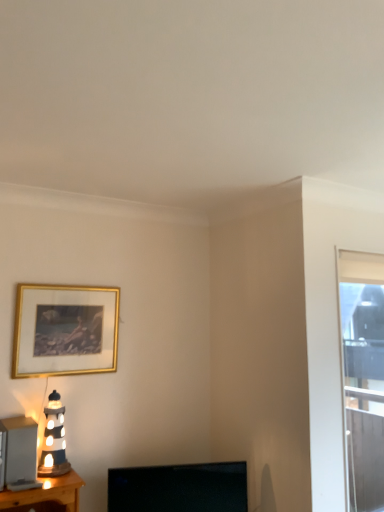
Question: Considering the relative sizes of gold metallic picture frame at upper left and matte ceramic lighthouse at left in the image provided, is gold metallic picture frame at upper left wider than matte ceramic lighthouse at left?

Choices:
 (A) yes
 (B) no

Answer: (B)

Question: Is matte ceramic lighthouse at left inside gold metallic picture frame at upper left?

Choices:
 (A) no
 (B) yes

Answer: (A)

Question: Can you confirm if gold metallic picture frame at upper left is bigger than matte ceramic lighthouse at left?

Choices:
 (A) yes
 (B) no

Answer: (A)

Question: Is gold metallic picture frame at upper left at the right side of matte ceramic lighthouse at left?

Choices:
 (A) no
 (B) yes

Answer: (B)

Question: Is gold metallic picture frame at upper left taller than matte ceramic lighthouse at left?

Choices:
 (A) yes
 (B) no

Answer: (A)

Question: Looking at their shapes, would you say gold metallic picture frame at upper left is wider or thinner than black glossy tv at lower center?

Choices:
 (A) thin
 (B) wide

Answer: (A)

Question: Is point (104, 296) closer or farther from the camera than point (135, 478)?

Choices:
 (A) closer
 (B) farther

Answer: (B)

Question: Is gold metallic picture frame at upper left taller or shorter than black glossy tv at lower center?

Choices:
 (A) short
 (B) tall

Answer: (B)

Question: From a real-world perspective, is gold metallic picture frame at upper left physically located above or below black glossy tv at lower center?

Choices:
 (A) below
 (B) above

Answer: (B)

Question: Does point (51, 465) appear closer or farther from the camera than point (165, 504)?

Choices:
 (A) closer
 (B) farther

Answer: (A)

Question: Is matte ceramic lighthouse at left wider or thinner than black glossy tv at lower center?

Choices:
 (A) thin
 (B) wide

Answer: (B)

Question: In the image, is matte ceramic lighthouse at left on the left side or the right side of black glossy tv at lower center?

Choices:
 (A) right
 (B) left

Answer: (B)

Question: Do you think matte ceramic lighthouse at left is within black glossy tv at lower center, or outside of it?

Choices:
 (A) inside
 (B) outside

Answer: (B)

Question: In the image, is matte black lamp at left on the left side or the right side of transparent glass window at right?

Choices:
 (A) right
 (B) left

Answer: (B)

Question: From the image's perspective, is matte black lamp at left above or below transparent glass window at right?

Choices:
 (A) above
 (B) below

Answer: (B)